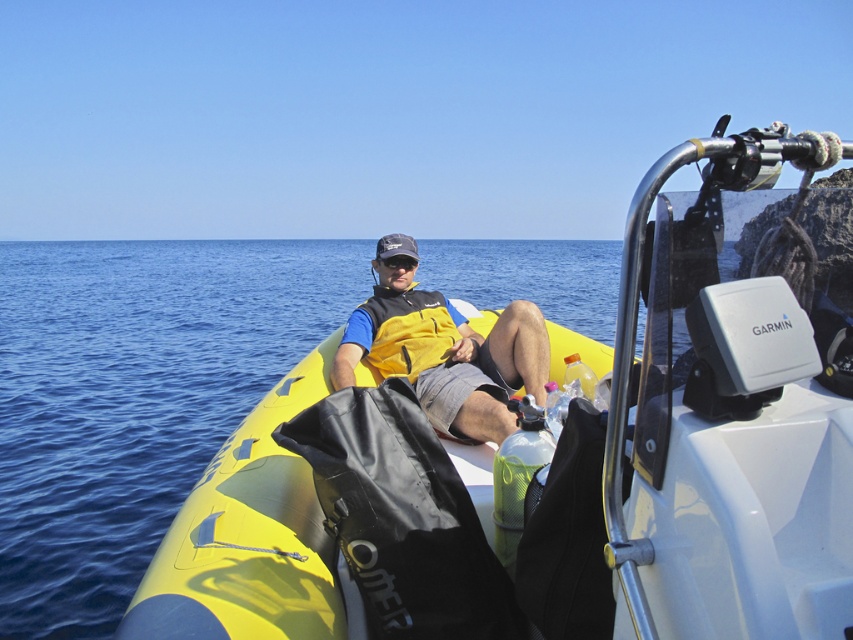
You are planning to store both the yellow matte life vest at center and the yellow fleece life jacket at center in a vertical locker. Which one should you place at the bottom to ensure both fit without overlapping?

The yellow fleece life jacket at center should be placed at the bottom since the yellow matte life vest at center is taller and would require more vertical space on top.

You are planning to store a new item in the yellow rubber boat at center. The item needs to be placed above the yellow matte life vest at center. Is there space available for this?

The yellow rubber boat at center is positioned under the yellow matte life vest at center, so there is no space above the life vest to place the new item.

You are planning to place a rectangular object that is 20 cm wide on the yellow rubber boat at center. Considering the size of the black matte goggles at center, will there be enough space on the boat to accommodate the object?

The yellow rubber boat at center is wider than the black matte goggles at center, but the exact width of the boat isn